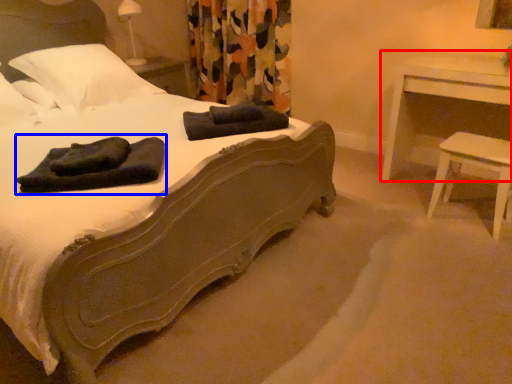
Question: Which of the following is the closest to the observer, nightstand (highlighted by a red box) or bath towel (highlighted by a blue box)?

Choices:
 (A) nightstand
 (B) bath towel

Answer: (B)